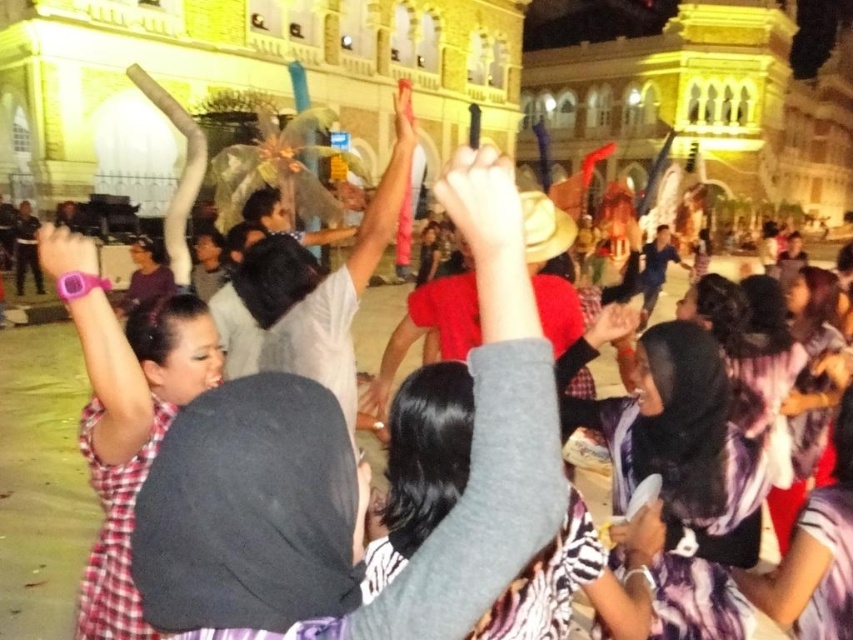
Question: Which of these objects is positioned farthest from the plaid fabric shirt at left?

Choices:
 (A) pink rubber wristband at upper left
 (B) smooth yellow fabric at upper center
 (C) smooth skin hand at center

Answer: (C)

Question: Observing the image, what is the correct spatial positioning of plaid fabric shirt at left in reference to pink matte hand at upper center?

Choices:
 (A) left
 (B) right

Answer: (A)

Question: Can you confirm if plaid fabric shirt at left is positioned to the right of pink rubber wristband at upper left?

Choices:
 (A) no
 (B) yes

Answer: (B)

Question: Can you confirm if matte black hand at upper center is smaller than matte black hand at center?

Choices:
 (A) no
 (B) yes

Answer: (A)

Question: Estimate the real-world distances between objects in this image. Which object is closer to the pink matte hand at upper center?

Choices:
 (A) pink rubber wristband at upper left
 (B) matte black hand at upper center

Answer: (B)

Question: Which of the following is the farthest from the observer?

Choices:
 (A) (611, 316)
 (B) (397, 118)

Answer: (B)